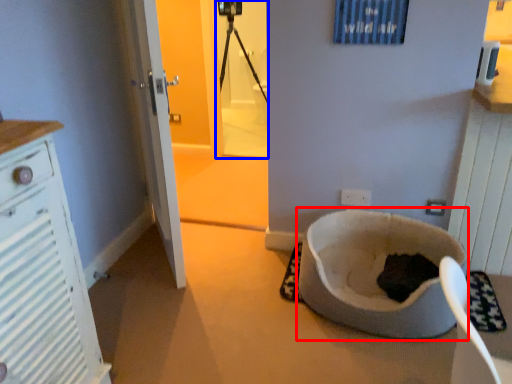
Question: Which of the following is the farthest to the observer, toilet bowl (highlighted by a red box) or screen door (highlighted by a blue box)?

Choices:
 (A) toilet bowl
 (B) screen door

Answer: (B)